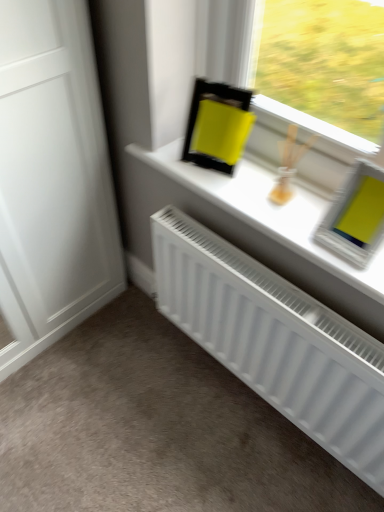
Question: From a real-world perspective, is white matte window sill at upper center positioned under white matte radiator at lower center based on gravity?

Choices:
 (A) yes
 (B) no

Answer: (B)

Question: Is white matte window sill at upper center smaller than white matte radiator at lower center?

Choices:
 (A) yes
 (B) no

Answer: (A)

Question: Does white matte window sill at upper center have a greater height compared to white matte radiator at lower center?

Choices:
 (A) yes
 (B) no

Answer: (B)

Question: From the image's perspective, is white matte window sill at upper center under white matte radiator at lower center?

Choices:
 (A) no
 (B) yes

Answer: (A)

Question: Is white matte window sill at upper center positioned behind white matte radiator at lower center?

Choices:
 (A) yes
 (B) no

Answer: (A)

Question: Considering the positions of point coord(276,276) and point coord(178,142), is point coord(276,276) closer or farther from the camera than point coord(178,142)?

Choices:
 (A) closer
 (B) farther

Answer: (A)

Question: In terms of height, does white matte radiator at lower center look taller or shorter compared to white matte window sill at upper center?

Choices:
 (A) short
 (B) tall

Answer: (B)

Question: Do you think white matte radiator at lower center is within white matte window sill at upper center, or outside of it?

Choices:
 (A) inside
 (B) outside

Answer: (B)

Question: In terms of width, does white matte radiator at lower center look wider or thinner when compared to white matte window sill at upper center?

Choices:
 (A) thin
 (B) wide

Answer: (A)

Question: From a real-world perspective, relative to white matte window sill at upper center, is white matte radiator at lower center vertically above or below?

Choices:
 (A) above
 (B) below

Answer: (B)

Question: From the image's perspective, is white matte radiator at lower center located above or below white matte window sill at upper center?

Choices:
 (A) below
 (B) above

Answer: (A)

Question: Visually, is white matte radiator at lower center positioned to the left or to the right of white matte window sill at upper center?

Choices:
 (A) left
 (B) right

Answer: (A)

Question: Looking at the image, does white matte radiator at lower center seem bigger or smaller compared to white matte window sill at upper center?

Choices:
 (A) small
 (B) big

Answer: (B)

Question: From their relative heights in the image, would you say white matte window sill at upper center is taller or shorter than white matte radiator at lower center?

Choices:
 (A) short
 (B) tall

Answer: (A)

Question: Considering their positions, is white matte window sill at upper center located in front of or behind white matte radiator at lower center?

Choices:
 (A) front
 (B) behind

Answer: (B)